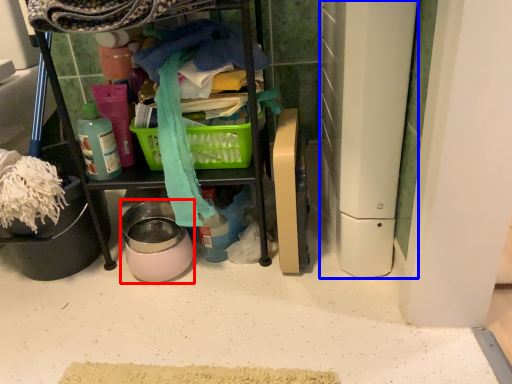
Question: Among these objects, which one is nearest to the camera, appliance (highlighted by a red box) or appliance (highlighted by a blue box)?

Choices:
 (A) appliance
 (B) appliance

Answer: (B)